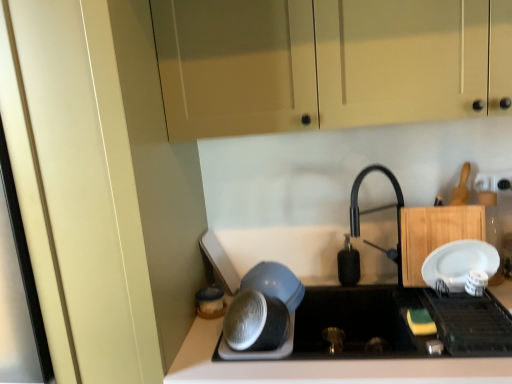
Question: From a real-world perspective, relative to wooden cutting board at right, placed as the first cabinetry when sorted from bottom to top, is matte plastic container at lower center, marked as the first appliance in a left-to-right arrangement, vertically above or below?

Choices:
 (A) above
 (B) below

Answer: (B)

Question: In the image, is matte plastic container at lower center, marked as the third appliance in a front-to-back arrangement, on the left side or the right side of wooden cutting board at right, placed as the first cabinetry when sorted from bottom to top?

Choices:
 (A) left
 (B) right

Answer: (A)

Question: Which of these objects is positioned closest to the white matte countertop at lower center?

Choices:
 (A) matte cream cabinet at upper center, the second cabinetry ordered from the bottom
 (B) wooden cutting board at right, placed as the first cabinetry when sorted from bottom to top
 (C) white plastic bowls at center, which is the 2th appliance from left to right
 (D) white plastic electric outlet at upper right
 (E) white glossy plate at upper right, which appears as the third appliance when viewed from the back

Answer: (C)

Question: Based on their relative distances, which object is nearer to the wooden cutting board at right, the 2th cabinetry from the top?

Choices:
 (A) matte cream cabinet at upper center, the second cabinetry ordered from the bottom
 (B) black matte soap dispenser at center, which is the 4th appliance from front to back
 (C) matte plastic container at lower center, marked as the first appliance in a left-to-right arrangement
 (D) white matte countertop at lower center
 (E) white plastic electric outlet at upper right

Answer: (E)